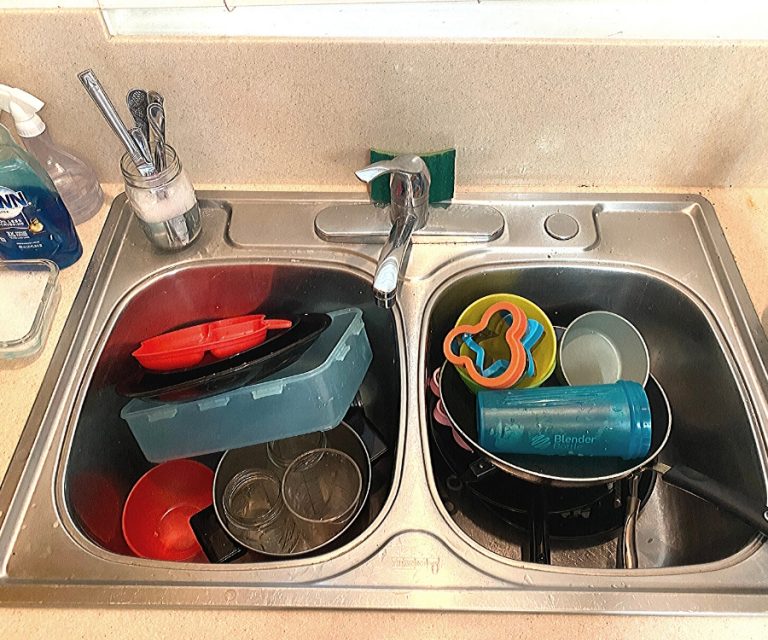
Where is `glass dish`? glass dish is located at coordinates 25,317, 40,278.